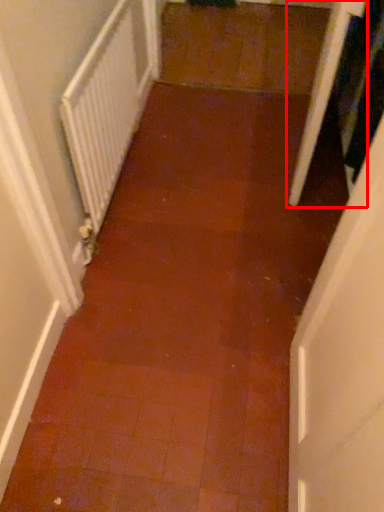
Question: From the image's perspective, where is screen door (annotated by the red box) located in relation to radiator in the image?

Choices:
 (A) above
 (B) below

Answer: (A)